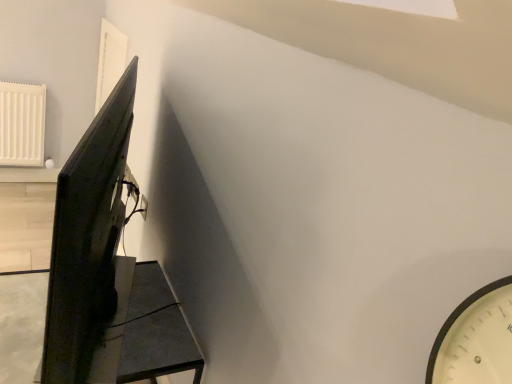
Image resolution: width=512 pixels, height=384 pixels. I want to click on vacant space situated above matte black table at lower left (from a real-world perspective), so click(x=105, y=323).